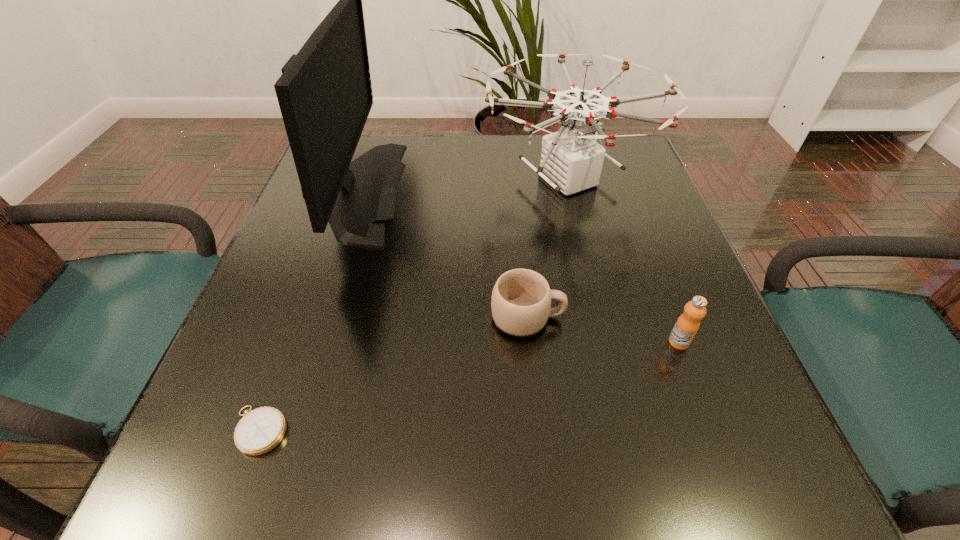
I want to click on monitor, so (325, 95).

The height and width of the screenshot is (540, 960). Identify the location of the second tallest object. (571, 161).

Image resolution: width=960 pixels, height=540 pixels. Find the location of `orange juice`. orange juice is located at coordinates (687, 325).

The height and width of the screenshot is (540, 960). In order to click on mug in this screenshot , I will do `click(521, 299)`.

Identify the location of the nearest object. This screenshot has height=540, width=960. (262, 429).

This screenshot has width=960, height=540. Identify the location of the shortest object. (262, 429).

Find the location of a particular element. free space located 0.090m on the screen side of the tallest object is located at coordinates pos(439,191).

The image size is (960, 540). Identify the location of free region located 0.370m on the front of the fourth shortest object. (622, 400).

The image size is (960, 540). What are the coordinates of `vacant space located on the front label of the orange juice` in the screenshot? It's located at (728, 471).

In order to click on vacant space located 0.120m on the side of the fourth tallest object with the handle in this screenshot , I will do `click(635, 318)`.